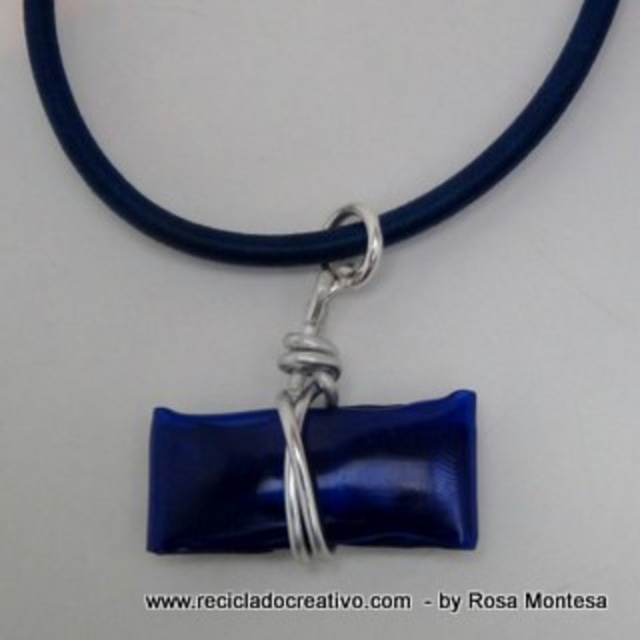
Question: Among these objects, which one is nearest to the camera?

Choices:
 (A) glossy blue glass pendant at center
 (B) glossy blue glass at center

Answer: (B)

Question: Where is glossy blue glass at center located in relation to glossy blue glass pendant at center in the image?

Choices:
 (A) left
 (B) right

Answer: (A)

Question: Among these points, which one is nearest to the camera?

Choices:
 (A) (362, 257)
 (B) (269, 461)

Answer: (B)

Question: Can you confirm if glossy blue glass at center is thinner than glossy blue glass pendant at center?

Choices:
 (A) yes
 (B) no

Answer: (B)

Question: Does glossy blue glass at center appear over glossy blue glass pendant at center?

Choices:
 (A) yes
 (B) no

Answer: (B)